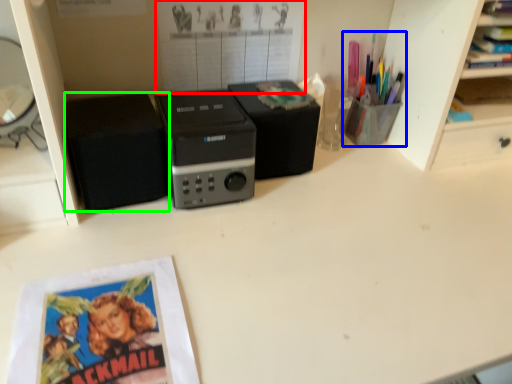
Question: Which object is positioned closest to poster page (highlighted by a red box)? Select from stationery (highlighted by a blue box) and speaker (highlighted by a green box).

Choices:
 (A) stationery
 (B) speaker

Answer: (B)